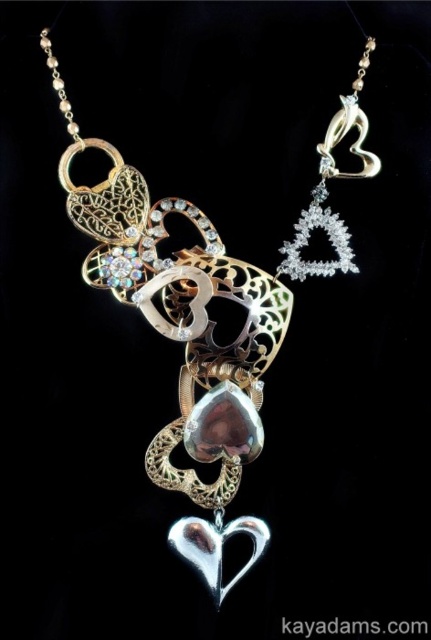
Looking at the necklace in the image, there are two heart shapes at the center. The silver metallic heart at center and the shiny silver heart at center. Which one is wider?

The silver metallic heart at center is wider than the shiny silver heart at center.

Looking at the necklace, you notice two key elements, the clear crystal triangle at upper center and the shiny silver heart at center. Which of these elements is wider?

The clear crystal triangle at upper center is wider than the shiny silver heart at center.

You are a jeweler who needs to ensure the necklace can fit into a display case that is 10 inches wide. Given the silver metallic heart at center and the shiny silver heart at center, will the necklace fit comfortably in the case?

The distance between the silver metallic heart at center and the shiny silver heart at center is 10.52 inches, which exceeds the 10 inch width of the display case. Therefore, the necklace will not fit comfortably in the case.